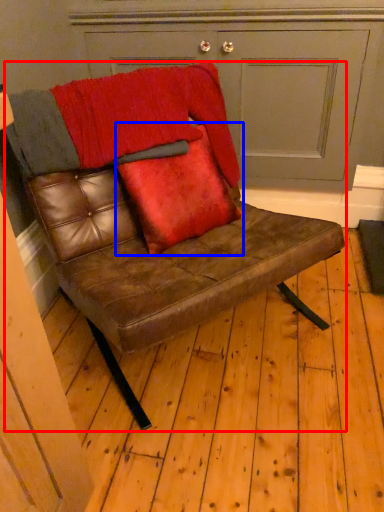
Question: Which object is further to the camera taking this photo, chair (highlighted by a red box) or throw pillow (highlighted by a blue box)?

Choices:
 (A) chair
 (B) throw pillow

Answer: (B)